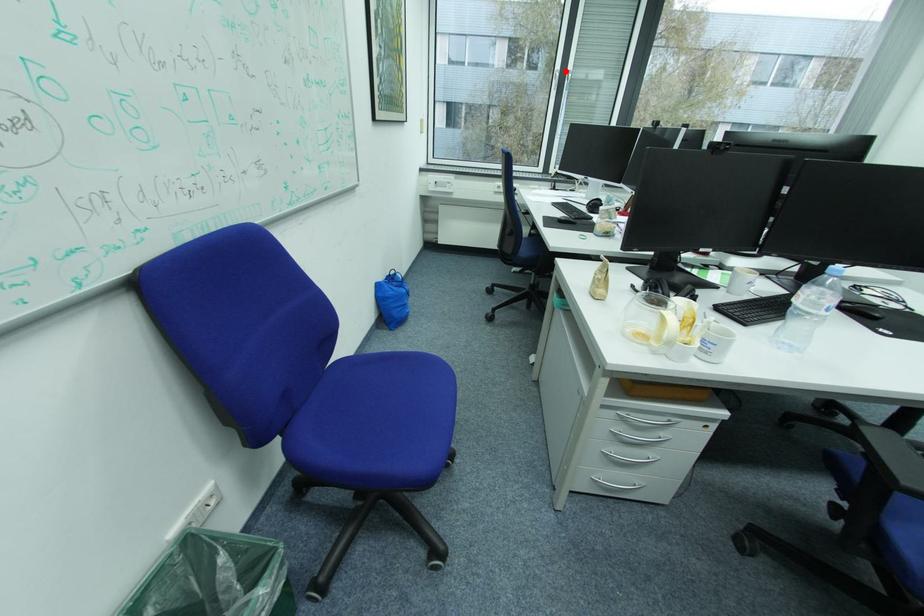
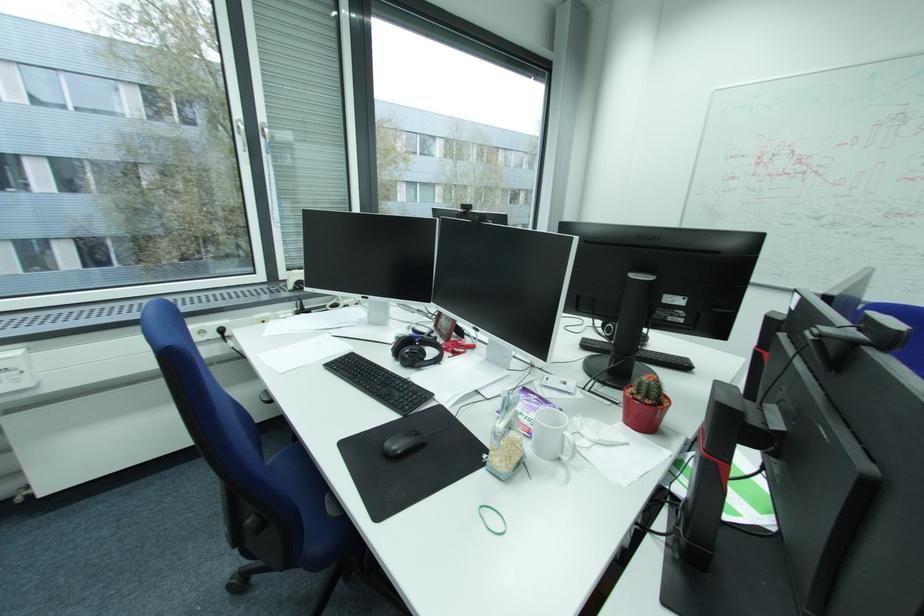
The point at the highlighted location is marked in the first image. Where is the corresponding point in the second image?

(247, 121)